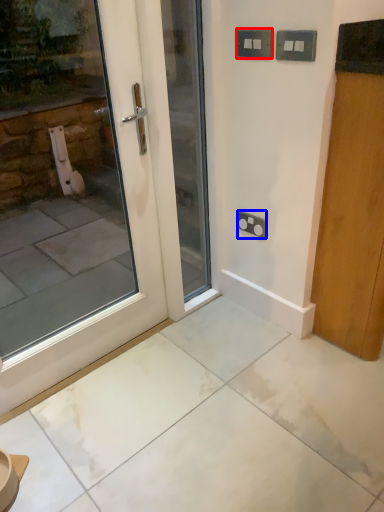
Question: Which object is further to the camera taking this photo, electric outlet (highlighted by a red box) or electric outlet (highlighted by a blue box)?

Choices:
 (A) electric outlet
 (B) electric outlet

Answer: (B)